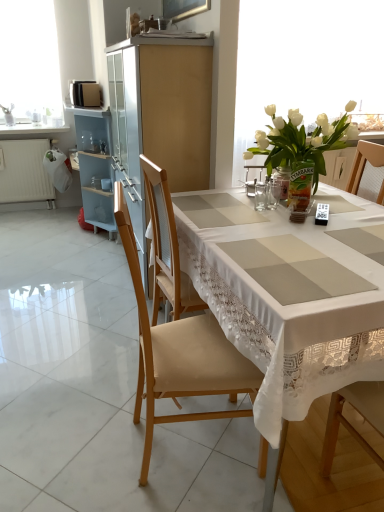
Find the location of a particular element. This screenshot has width=384, height=512. vacant space to the left of matte wood cabinet at center is located at coordinates (67, 269).